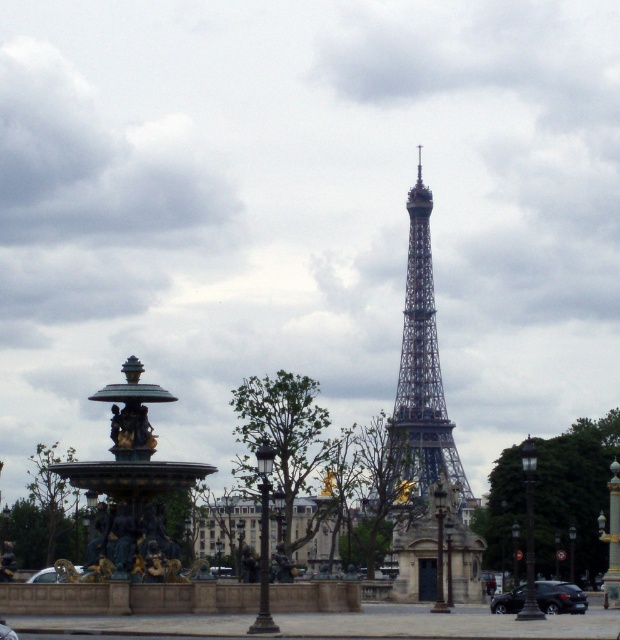
Question: From the image, what is the correct spatial relationship of bronze sculpture fountain at left in relation to shiny steel eiffel tower at center?

Choices:
 (A) right
 (B) left

Answer: (B)

Question: Among these objects, which one is farthest from the camera?

Choices:
 (A) bronze sculpture fountain at left
 (B) metallic silver car at lower left
 (C) shiny silver car at center

Answer: (B)

Question: From the image, what is the correct spatial relationship of shiny steel eiffel tower at center in relation to metallic silver car at lower left?

Choices:
 (A) right
 (B) left

Answer: (A)

Question: Among these objects, which one is farthest from the camera?

Choices:
 (A) shiny silver car at center
 (B) metallic silver car at lower left
 (C) shiny steel eiffel tower at center
 (D) bronze sculpture fountain at left

Answer: (C)

Question: Which is farther from the bronze sculpture fountain at left?

Choices:
 (A) shiny silver car at center
 (B) metallic silver car at lower left

Answer: (B)

Question: Is bronze sculpture fountain at left below shiny silver car at center?

Choices:
 (A) yes
 (B) no

Answer: (B)